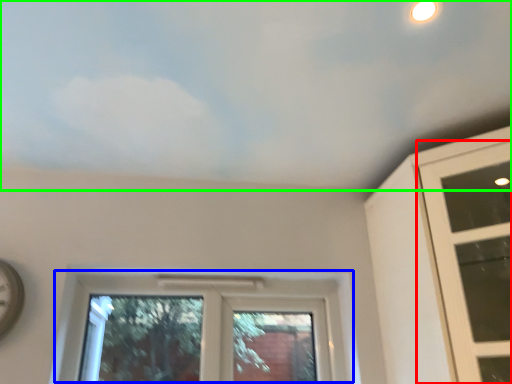
Question: Based on their relative distances, which object is farther from window (highlighted by a red box)? Choose from window (highlighted by a blue box) and cloud (highlighted by a green box).

Choices:
 (A) window
 (B) cloud

Answer: (A)